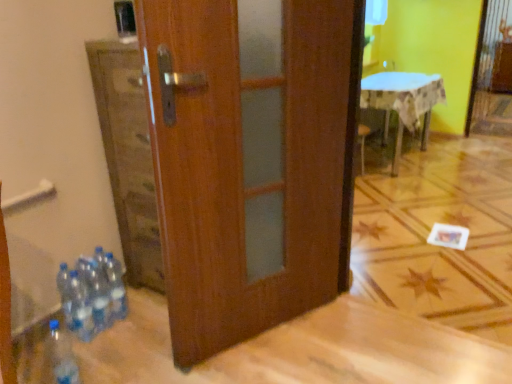
Where is `vacant region in front of clear plastic bottles at lower left, positioned as the 3th bottle in front-to-back order`? This screenshot has height=384, width=512. vacant region in front of clear plastic bottles at lower left, positioned as the 3th bottle in front-to-back order is located at coordinates (105, 342).